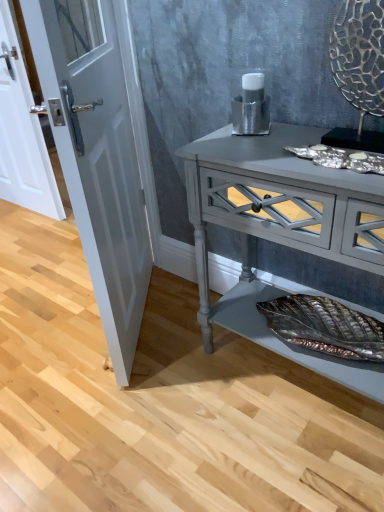
Image resolution: width=384 pixels, height=512 pixels. Identify the location of free area in between matte gray console table at center and white glossy door at left, arranged as the first door when viewed from the right. (195, 360).